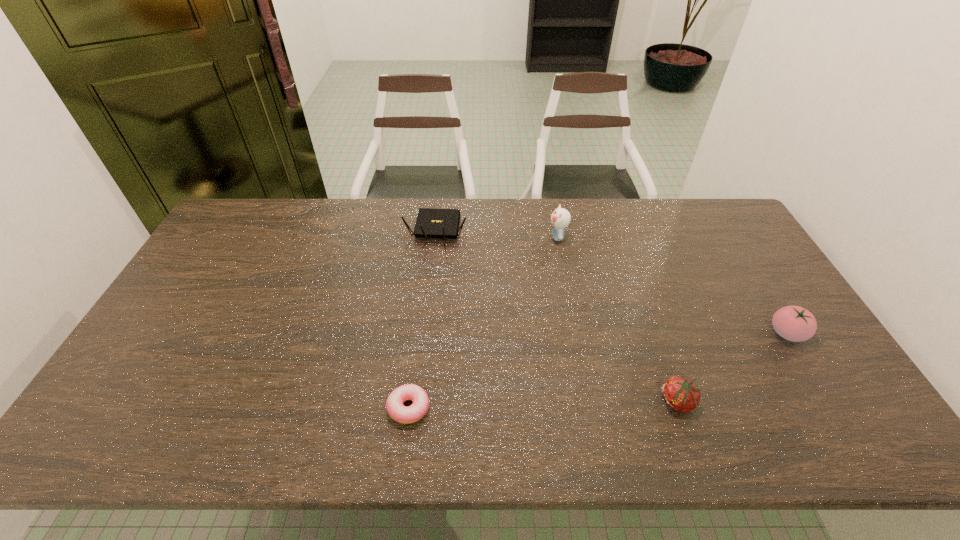
Find the location of a particular element. unoccupied area between the second shortest object and the router is located at coordinates (557, 316).

The width and height of the screenshot is (960, 540). In order to click on free space between the doughnut and the left tomato in this screenshot , I will do `click(543, 404)`.

Find the location of a particular element. unoccupied area between the router and the taller tomato is located at coordinates (612, 281).

Find the location of a particular element. Image resolution: width=960 pixels, height=540 pixels. free space that is in between the farther tomato and the router is located at coordinates (612, 281).

The width and height of the screenshot is (960, 540). Find the location of `unoccupied area between the fourth tallest object and the router`. unoccupied area between the fourth tallest object and the router is located at coordinates (557, 316).

What are the coordinates of `free space between the router and the doughnut` in the screenshot? It's located at (422, 319).

Locate an element on the screen. object identified as the second closest to the shortest object is located at coordinates (680, 394).

Point out which object is positioned as the nearest to the taller tomato. Please provide its 2D coordinates. Your answer should be formatted as a tuple, i.e. [(x, y)], where the tuple contains the x and y coordinates of a point satisfying the conditions above.

[(680, 394)]

At what (x,y) coordinates should I click in order to perform the action: click on free location that satisfies the following two spatial constraints: 1. on the back side of the shortest object; 2. on the left side of the shorter tomato. Please return your answer as a coordinate pair (x, y). Image resolution: width=960 pixels, height=540 pixels. Looking at the image, I should click on (409, 402).

In order to click on free space that satisfies the following two spatial constraints: 1. on the front-facing side of the third object from right to left; 2. on the front side of the doughnut in this screenshot , I will do pyautogui.click(x=590, y=407).